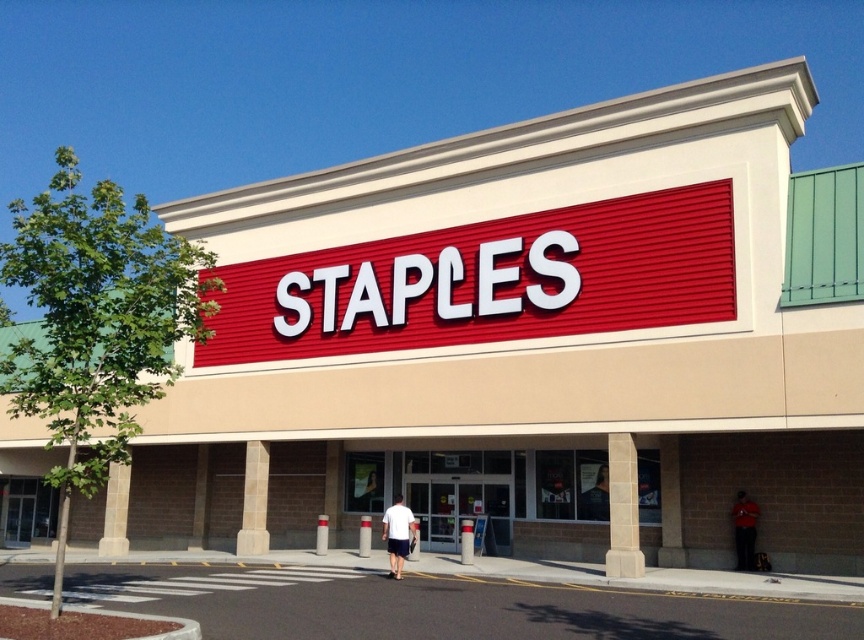
Can you confirm if red shirt at lower right is wider than smooth black shirt at lower center?

No.

Can you confirm if red shirt at lower right is positioned below smooth black shirt at lower center?

Indeed, red shirt at lower right is positioned under smooth black shirt at lower center.

Describe the element at coordinates (744, 529) in the screenshot. The width and height of the screenshot is (864, 640). I see `red shirt at lower right` at that location.

Locate an element on the screen. red shirt at lower right is located at coordinates (744, 529).

Which is more to the right, white matte shirt at center or red shirt at lower right?

Positioned to the right is red shirt at lower right.

Between point (410, 516) and point (747, 570), which one is positioned in front?

Point (410, 516) is in front.

Identify the location of white matte shirt at center. (397, 534).

Is point (413, 540) behind point (604, 480)?

That is False.

Between white matte shirt at center and smooth black shirt at lower center, which one is positioned lower?

Positioned lower is smooth black shirt at lower center.

Describe the element at coordinates (397, 534) in the screenshot. Image resolution: width=864 pixels, height=640 pixels. I see `white matte shirt at center` at that location.

You are a GUI agent. You are given a task and a screenshot of the screen. Output one action in this format:
    pyautogui.click(x=<x>, y=<y>)
    Task: Click on the white matte shirt at center
    Image resolution: width=864 pixels, height=640 pixels.
    Given the screenshot: What is the action you would take?
    pyautogui.click(x=397, y=534)